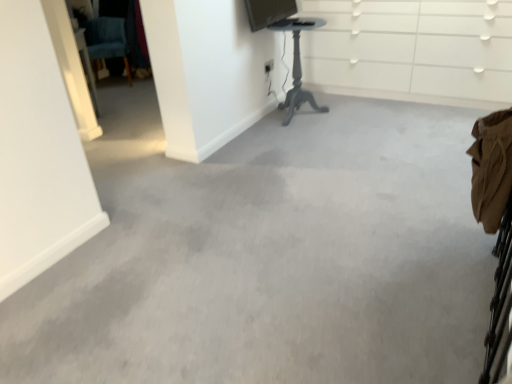
This screenshot has height=384, width=512. Describe the element at coordinates (297, 65) in the screenshot. I see `matte gray table at center` at that location.

Where is `matte gray table at center`? matte gray table at center is located at coordinates (297, 65).

Image resolution: width=512 pixels, height=384 pixels. What do you see at coordinates (412, 50) in the screenshot?
I see `white glossy dresser at upper center` at bounding box center [412, 50].

Measure the distance between white glossy dresser at upper center and camera.

They are 10.05 feet apart.

You are a GUI agent. You are given a task and a screenshot of the screen. Output one action in this format:
    pyautogui.click(x=<x>, y=<y>)
    Task: Click on the teal fabric swivel chair at upper left
    Image resolution: width=512 pixels, height=384 pixels.
    Given the screenshot: What is the action you would take?
    pyautogui.click(x=106, y=41)

Does teal fabric swivel chair at upper left have a smaller size compared to matte gray table at center?

Indeed, teal fabric swivel chair at upper left has a smaller size compared to matte gray table at center.

From a real-world perspective, is teal fabric swivel chair at upper left positioned above or below matte gray table at center?

teal fabric swivel chair at upper left is situated lower than matte gray table at center in the real world.

Identify the location of swivel chair on the left of the matte gray table at center. (106, 41).

Looking at this image, measure the distance between teal fabric swivel chair at upper left and matte gray table at center.

A distance of 2.14 meters exists between teal fabric swivel chair at upper left and matte gray table at center.

Is matte gray table at center taller than white glossy dresser at upper center?

No.

From the image's perspective, does matte gray table at center appear higher than white glossy dresser at upper center?

No.

Looking at the image, does matte gray table at center seem bigger or smaller compared to white glossy dresser at upper center?

Clearly, matte gray table at center is smaller in size than white glossy dresser at upper center.

In the scene shown: Is white glossy dresser at upper center placed right next to matte gray table at center?

They are not placed beside each other.

Where is `furniture directly beneath the white glossy dresser at upper center (from a real-world perspective)`? The width and height of the screenshot is (512, 384). furniture directly beneath the white glossy dresser at upper center (from a real-world perspective) is located at coordinates (297, 65).

Is white glossy dresser at upper center outside of matte gray table at center?

Indeed, white glossy dresser at upper center is completely outside matte gray table at center.

Which point is more forward, (119, 20) or (400, 85)?

The point (400, 85) is more forward.

Looking at this image, considering the sizes of objects teal fabric swivel chair at upper left and white glossy dresser at upper center in the image provided, who is smaller, teal fabric swivel chair at upper left or white glossy dresser at upper center?

With smaller size is teal fabric swivel chair at upper left.

Is teal fabric swivel chair at upper left wider or thinner than white glossy dresser at upper center?

In the image, teal fabric swivel chair at upper left appears to be more narrow than white glossy dresser at upper center.

Identify the location of swivel chair below the white glossy dresser at upper center (from a real-world perspective). (106, 41).

Is white glossy dresser at upper center at the back of matte black monitor at upper center?

matte black monitor at upper center is not turned away from white glossy dresser at upper center.

Which point is more distant from viewer, [269,23] or [511,73]?

The point [269,23] is more distant.

Locate an element on the screen. This screenshot has width=512, height=384. dresser behind the matte black monitor at upper center is located at coordinates (412, 50).

In the scene shown: Is white glossy dresser at upper center surrounded by matte black monitor at upper center?

No, matte black monitor at upper center does not contain white glossy dresser at upper center.

Can you confirm if white glossy dresser at upper center is shorter than matte black monitor at upper center?

Incorrect, the height of white glossy dresser at upper center does not fall short of that of matte black monitor at upper center.

Is white glossy dresser at upper center not near matte black monitor at upper center?

No, white glossy dresser at upper center is not far away from matte black monitor at upper center.

Is white glossy dresser at upper center wider than matte black monitor at upper center?

Yes, white glossy dresser at upper center is wider than matte black monitor at upper center.

Is white glossy dresser at upper center oriented towards matte black monitor at upper center?

Yes, white glossy dresser at upper center is turned towards matte black monitor at upper center.

Is white glossy dresser at upper center with teal fabric swivel chair at upper left?

No, white glossy dresser at upper center is not with teal fabric swivel chair at upper left.

Is point (499, 87) closer to camera compared to point (111, 41)?

Yes.

From a real-world perspective, who is located lower, white glossy dresser at upper center or teal fabric swivel chair at upper left?

From a 3D spatial view, teal fabric swivel chair at upper left is below.

You are a GUI agent. You are given a task and a screenshot of the screen. Output one action in this format:
    pyautogui.click(x=<x>, y=<y>)
    Task: Click on the swivel chair to the left of matte gray table at center
    
    Given the screenshot: What is the action you would take?
    pyautogui.click(x=106, y=41)

Where is `dresser that appears above the matte gray table at center (from the image's perspective)`? The width and height of the screenshot is (512, 384). dresser that appears above the matte gray table at center (from the image's perspective) is located at coordinates pyautogui.click(x=412, y=50).

From the image, which object appears to be farther from teal fabric swivel chair at upper left, matte gray table at center or white glossy dresser at upper center?

Among the two, white glossy dresser at upper center is located further to teal fabric swivel chair at upper left.

Based on their spatial positions, is matte black monitor at upper center or white glossy dresser at upper center further from teal fabric swivel chair at upper left?

The object further to teal fabric swivel chair at upper left is white glossy dresser at upper center.

From the image, which object appears to be farther from matte gray table at center, matte black monitor at upper center or teal fabric swivel chair at upper left?

Among the two, teal fabric swivel chair at upper left is located further to matte gray table at center.

Looking at the image, which one is located further to matte gray table at center, white glossy dresser at upper center or teal fabric swivel chair at upper left?

teal fabric swivel chair at upper left lies further to matte gray table at center than the other object.

From the picture: When comparing their distances from matte black monitor at upper center, does teal fabric swivel chair at upper left or matte gray table at center seem further?

Based on the image, teal fabric swivel chair at upper left appears to be further to matte black monitor at upper center.

Considering their positions, is teal fabric swivel chair at upper left positioned further to matte gray table at center than white glossy dresser at upper center?

teal fabric swivel chair at upper left is further to matte gray table at center.

When comparing their distances from teal fabric swivel chair at upper left, does white glossy dresser at upper center or matte black monitor at upper center seem further?

The object further to teal fabric swivel chair at upper left is white glossy dresser at upper center.

Estimate the real-world distances between objects in this image. Which object is closer to matte gray table at center, white glossy dresser at upper center or matte black monitor at upper center?

matte black monitor at upper center.

Find the location of a particular element. The height and width of the screenshot is (384, 512). furniture situated between matte black monitor at upper center and white glossy dresser at upper center from left to right is located at coordinates (x=297, y=65).

In order to click on furniture between teal fabric swivel chair at upper left and white glossy dresser at upper center in the horizontal direction in this screenshot , I will do `click(297, 65)`.

At what (x,y) coordinates should I click in order to perform the action: click on computer monitor between teal fabric swivel chair at upper left and matte gray table at center in the horizontal direction. Please return your answer as a coordinate pair (x, y). Looking at the image, I should click on (268, 12).

The image size is (512, 384). I want to click on computer monitor situated between teal fabric swivel chair at upper left and white glossy dresser at upper center from left to right, so click(268, 12).